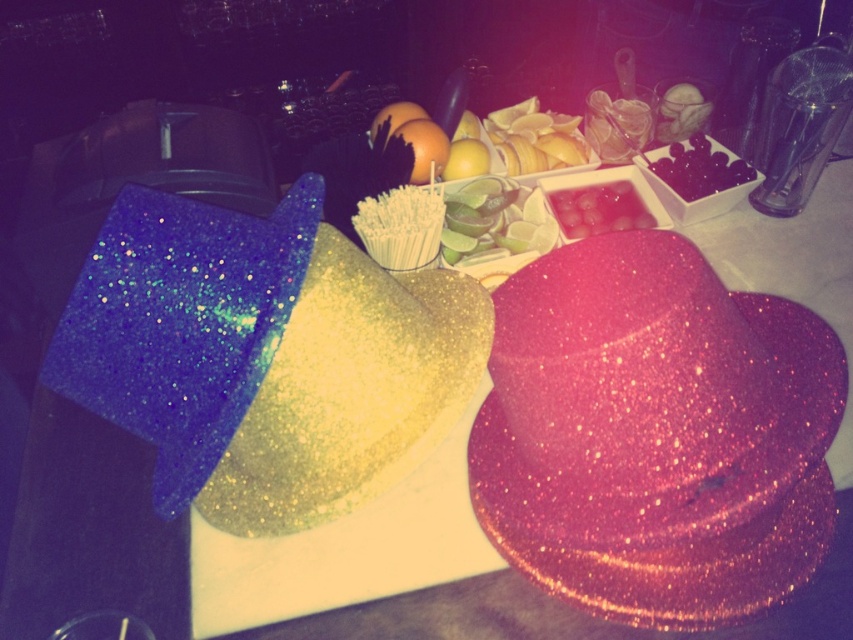
Question: Does pink glittery hat at center appear over pink glittery watermelon at center?

Choices:
 (A) no
 (B) yes

Answer: (A)

Question: Does pink glittery hat at center appear over black glossy grapes at upper right?

Choices:
 (A) yes
 (B) no

Answer: (B)

Question: Which object is closer to the camera taking this photo?

Choices:
 (A) pink glittery hat at center
 (B) pink glittery watermelon at center

Answer: (A)

Question: Which of the following is the farthest from the observer?

Choices:
 (A) (688, 144)
 (B) (607, 196)
 (C) (761, 544)

Answer: (A)

Question: Which point is farther to the camera?

Choices:
 (A) black glossy grapes at upper right
 (B) pink glittery watermelon at center
 (C) green matte lime at center

Answer: (A)

Question: Is green matte lime at center wider than pink glittery watermelon at center?

Choices:
 (A) no
 (B) yes

Answer: (B)